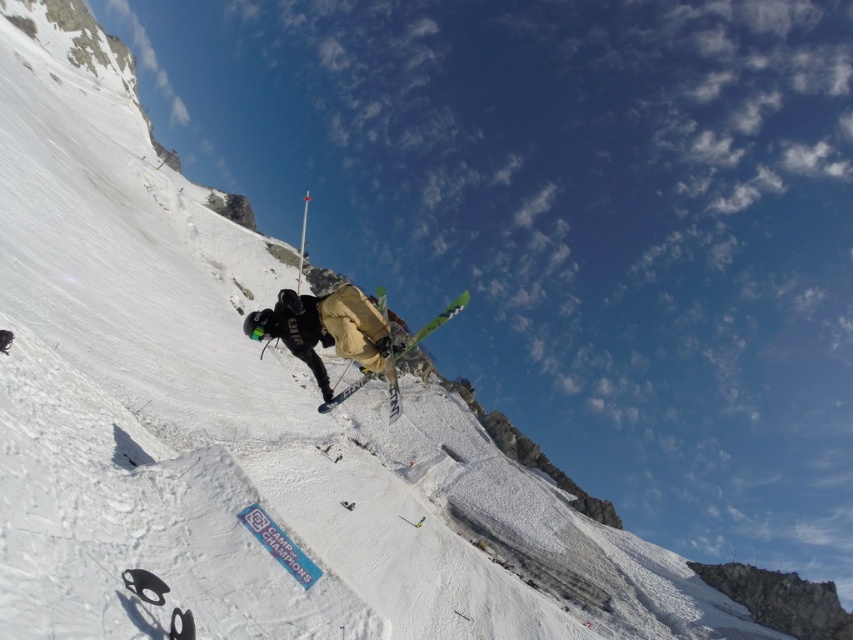
Question: Among these objects, which one is nearest to the camera?

Choices:
 (A) green metallic skis at center
 (B) matte khaki ski suit at center

Answer: (B)

Question: Is matte khaki ski suit at center above green metallic skis at center?

Choices:
 (A) no
 (B) yes

Answer: (A)

Question: Can you confirm if matte khaki ski suit at center is positioned above green metallic skis at center?

Choices:
 (A) no
 (B) yes

Answer: (A)

Question: Among these objects, which one is nearest to the camera?

Choices:
 (A) matte khaki ski suit at center
 (B) green metallic skis at center

Answer: (A)

Question: Does matte khaki ski suit at center appear over green metallic skis at center?

Choices:
 (A) no
 (B) yes

Answer: (A)